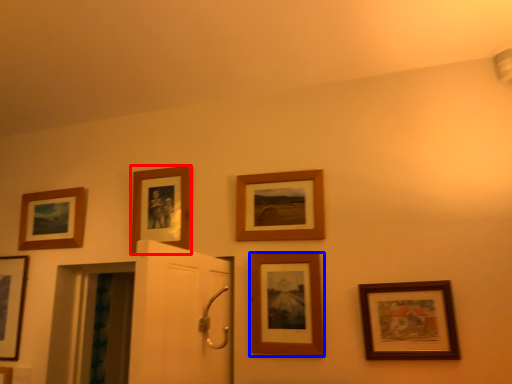
Question: Among these objects, which one is nearest to the camera, picture frame (highlighted by a red box) or picture frame (highlighted by a blue box)?

Choices:
 (A) picture frame
 (B) picture frame

Answer: (B)